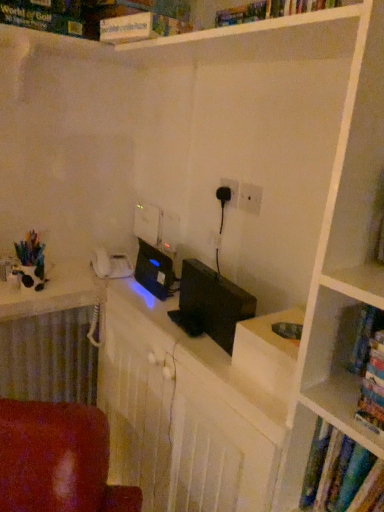
The height and width of the screenshot is (512, 384). What do you see at coordinates (373, 386) in the screenshot?
I see `multicolored paper book at right, the second book viewed from the back` at bounding box center [373, 386].

What do you see at coordinates (231, 189) in the screenshot?
I see `black plastic electric outlet at center, the second electric outlet from the right` at bounding box center [231, 189].

The width and height of the screenshot is (384, 512). In order to click on black plastic computer desk at center in this screenshot , I will do `click(193, 406)`.

Considering the sizes of objects white matte puzzle box at upper center and multicolored paper book at right, which ranks as the first book in front-to-back order, in the image provided, who is bigger, white matte puzzle box at upper center or multicolored paper book at right, which ranks as the first book in front-to-back order,?

white matte puzzle box at upper center.

How distant is white matte puzzle box at upper center from multicolored paper book at right, which is the 1th book in top-to-bottom order?

37.58 inches.

Can you confirm if white matte puzzle box at upper center is shorter than multicolored paper book at right, the 2th book from the bottom?

Indeed, white matte puzzle box at upper center has a lesser height compared to multicolored paper book at right, the 2th book from the bottom.

From a real-world perspective, which object rests below the other?

multicolored paper book at right, which ranks as the first book in front-to-back order, from a real-world perspective.

From the image's perspective, which is above, black matte computer monitor at center or white matte puzzle box at upper center?

white matte puzzle box at upper center.

From a real-world perspective, is black matte computer monitor at center under white matte puzzle box at upper center?

Yes, from a real-world perspective, black matte computer monitor at center is beneath white matte puzzle box at upper center.

Is black matte computer monitor at center positioned with its back to white matte puzzle box at upper center?

No, white matte puzzle box at upper center is not at the back of black matte computer monitor at center.

Is black matte computer monitor at center shorter than white textured radiator at lower left?

Correct, black matte computer monitor at center is not as tall as white textured radiator at lower left.

How distant is black matte computer monitor at center from white textured radiator at lower left?

black matte computer monitor at center is 69.87 centimeters from white textured radiator at lower left.

From the image's perspective, would you say black matte computer monitor at center is shown under white textured radiator at lower left?

Actually, black matte computer monitor at center appears above white textured radiator at lower left in the image.

Can you confirm if black matte computer monitor at center is positioned to the right of white textured radiator at lower left?

Indeed, black matte computer monitor at center is positioned on the right side of white textured radiator at lower left.

Could you tell me if hardcover book at right, which ranks as the first book in bottom-to-top order, is facing white matte puzzle box at upper center?

No, hardcover book at right, which ranks as the first book in bottom-to-top order, is not oriented towards white matte puzzle box at upper center.

Can you confirm if hardcover book at right, placed as the 2th book when sorted from top to bottom, is shorter than white matte puzzle box at upper center?

No, hardcover book at right, placed as the 2th book when sorted from top to bottom, is not shorter than white matte puzzle box at upper center.

From a real-world perspective, which is physically below, hardcover book at right, the 2th book viewed from the front, or white matte puzzle box at upper center?

From a 3D spatial view, hardcover book at right, the 2th book viewed from the front, is below.

Is black plastic electric outlet at center, the second electric outlet from the right, in contact with black plastic computer desk at center?

No, black plastic electric outlet at center, the second electric outlet from the right, is not next to black plastic computer desk at center.

Who is smaller, black plastic electric outlet at center, the second electric outlet from the right, or black plastic computer desk at center?

With smaller size is black plastic electric outlet at center, the second electric outlet from the right.

Would you say black plastic electric outlet at center, the 1th electric outlet positioned from the back, is inside or outside black plastic computer desk at center?

black plastic electric outlet at center, the 1th electric outlet positioned from the back, is spatially situated outside black plastic computer desk at center.

From the image's perspective, is hardcover book at right, the 2th book viewed from the front, beneath black plastic electric outlet at center, positioned as the 1th electric outlet in left-to-right order?

Correct, hardcover book at right, the 2th book viewed from the front, appears lower than black plastic electric outlet at center, positioned as the 1th electric outlet in left-to-right order, in the image.

Would you consider hardcover book at right, which ranks as the first book in bottom-to-top order, to be distant from black plastic electric outlet at center, positioned as the 1th electric outlet in left-to-right order?

hardcover book at right, which ranks as the first book in bottom-to-top order, is near black plastic electric outlet at center, positioned as the 1th electric outlet in left-to-right order, not far away.

Does point (358, 453) appear closer or farther from the camera than point (237, 200)?

Clearly, point (358, 453) is closer to the camera than point (237, 200).

Based on the photo, from a real-world perspective, is hardcover book at right, arranged as the 1th book when viewed from the back, positioned under black plastic electric outlet at center, the second electric outlet from the right, based on gravity?

Yes.

Is white plastic electric outlet at center, acting as the first electric outlet starting from the right, surrounding white matte puzzle box at upper center?

No, white matte puzzle box at upper center is not inside white plastic electric outlet at center, acting as the first electric outlet starting from the right.

From a real-world perspective, is white plastic electric outlet at center, which ranks as the second electric outlet in back-to-front order, positioned under white matte puzzle box at upper center based on gravity?

Yes.

Can you confirm if white plastic electric outlet at center, which appears as the 1th electric outlet when viewed from the front, is thinner than white matte puzzle box at upper center?

Indeed, white plastic electric outlet at center, which appears as the 1th electric outlet when viewed from the front, has a lesser width compared to white matte puzzle box at upper center.

Is white plastic electric outlet at center, which ranks as the second electric outlet in back-to-front order, next to white matte puzzle box at upper center?

No, white plastic electric outlet at center, which ranks as the second electric outlet in back-to-front order, is not beside white matte puzzle box at upper center.

This screenshot has height=512, width=384. What are the coordinates of `paperback book that appears above the multicolored paper book at right, which is the 1th book in top-to-bottom order (from a real-world perspective)` in the screenshot? It's located at (140, 27).

Where is `computer monitor on the right of white matte puzzle box at upper center`? This screenshot has height=512, width=384. computer monitor on the right of white matte puzzle box at upper center is located at coordinates (214, 301).

Based on their spatial positions, is black plastic computer desk at center or black matte computer monitor at center further from white plastic electric outlet at center, the 2th electric outlet viewed from the left?

Among the two, black plastic computer desk at center is located further to white plastic electric outlet at center, the 2th electric outlet viewed from the left.

Which object lies nearer to the anchor point multicolored paper book at right, which ranks as the first book in front-to-back order, white plastic electric outlet at center, which ranks as the second electric outlet in back-to-front order, or black matte computer monitor at center?

Among the two, black matte computer monitor at center is located nearer to multicolored paper book at right, which ranks as the first book in front-to-back order.

Based on their spatial positions, is hardcover book at right, the 2th book viewed from the front, or white textured radiator at lower left further from multicolored paper book at right, which is the 1th book in top-to-bottom order?

white textured radiator at lower left lies further to multicolored paper book at right, which is the 1th book in top-to-bottom order, than the other object.

Looking at the image, which one is located further to white matte puzzle box at upper center, black plastic computer desk at center or black matte computer monitor at center?

Among the two, black plastic computer desk at center is located further to white matte puzzle box at upper center.

Looking at the image, which one is located further to white matte puzzle box at upper center, black matte computer monitor at center or black plastic computer desk at center?

Based on the image, black plastic computer desk at center appears to be further to white matte puzzle box at upper center.

From the image, which object appears to be farther from black plastic computer desk at center, black plastic electric outlet at center, positioned as the 1th electric outlet in left-to-right order, or white plastic electric outlet at center, acting as the first electric outlet starting from the right?

The object further to black plastic computer desk at center is black plastic electric outlet at center, positioned as the 1th electric outlet in left-to-right order.

When comparing their distances from hardcover book at right, the 2th book viewed from the front, does black matte computer monitor at center or white textured radiator at lower left seem closer?

The object closer to hardcover book at right, the 2th book viewed from the front, is black matte computer monitor at center.

Based on their spatial positions, is black plastic electric outlet at center, the second electric outlet from the right, or multicolored paper book at right, which is the 1th book in top-to-bottom order, closer to white plastic electric outlet at center, the 2th electric outlet viewed from the left?

black plastic electric outlet at center, the second electric outlet from the right, is closer to white plastic electric outlet at center, the 2th electric outlet viewed from the left.

The width and height of the screenshot is (384, 512). I want to click on computer desk between white textured radiator at lower left and multicolored paper book at right, the 2th book from the bottom, in the horizontal direction, so click(x=193, y=406).

The width and height of the screenshot is (384, 512). Find the location of `radiator that lies between white matte puzzle box at upper center and black plastic computer desk at center from top to bottom`. radiator that lies between white matte puzzle box at upper center and black plastic computer desk at center from top to bottom is located at coordinates (49, 357).

Where is `book located between white textured radiator at lower left and hardcover book at right, arranged as the 1th book when viewed from the back, in the left-right direction`? Image resolution: width=384 pixels, height=512 pixels. book located between white textured radiator at lower left and hardcover book at right, arranged as the 1th book when viewed from the back, in the left-right direction is located at coordinates (373, 386).

Where is `computer monitor between white textured radiator at lower left and white plastic electric outlet at center, the 2th electric outlet viewed from the left, from left to right`? This screenshot has width=384, height=512. computer monitor between white textured radiator at lower left and white plastic electric outlet at center, the 2th electric outlet viewed from the left, from left to right is located at coordinates (214, 301).